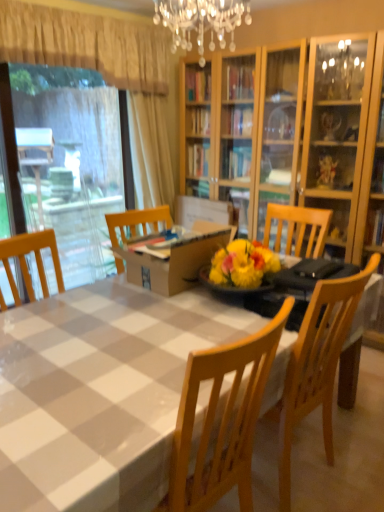
Question: From the image's perspective, is brown cardboard box at center above or below beige fabric curtain at upper left?

Choices:
 (A) below
 (B) above

Answer: (A)

Question: From a real-world perspective, relative to beige fabric curtain at upper left, is brown cardboard box at center vertically above or below?

Choices:
 (A) below
 (B) above

Answer: (A)

Question: Based on their relative distances, which object is nearer to the wooden chair at center?

Choices:
 (A) white checkered tablecloth at center
 (B) brown cardboard box at center
 (C) beige fabric curtain at upper left
 (D) transparent plastic window screen at left

Answer: (A)

Question: Which of these objects is positioned closest to the white checkered tablecloth at center?

Choices:
 (A) beige fabric curtain at upper left
 (B) brown cardboard box at center
 (C) wooden chair at center
 (D) transparent plastic window screen at left

Answer: (B)